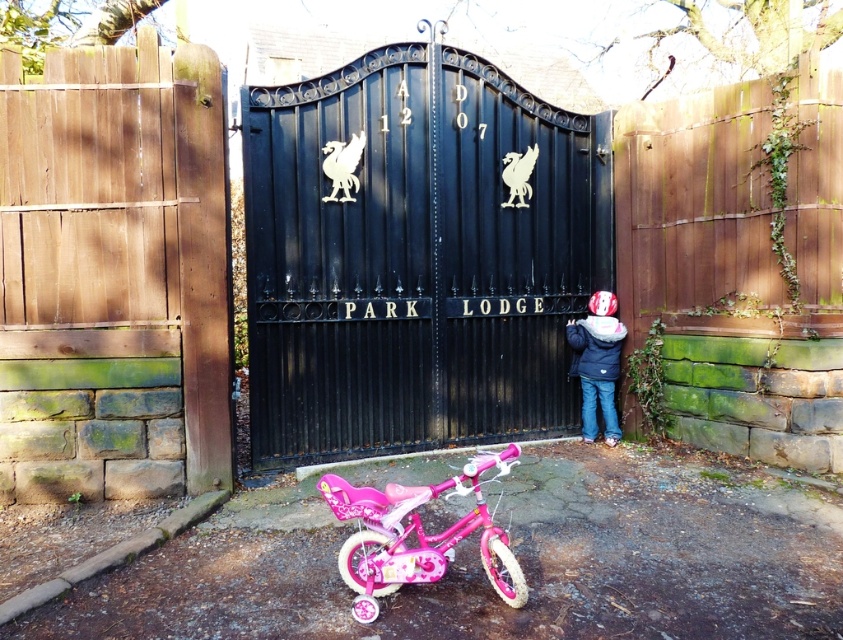
Is point (283, 211) positioned in front of point (509, 584)?

No, it is not.

Between black metal gate at center and pink glossy bicycle at lower center, which one is positioned higher?

black metal gate at center

What do you see at coordinates (416, 257) in the screenshot? I see `black metal gate at center` at bounding box center [416, 257].

The height and width of the screenshot is (640, 843). I want to click on black metal gate at center, so click(416, 257).

Can you confirm if pink glossy bicycle at lower center is taller than matte blue jacket at center?

Incorrect, pink glossy bicycle at lower center's height is not larger of matte blue jacket at center's.

Is pink glossy bicycle at lower center closer to camera compared to matte blue jacket at center?

Yes, it is in front of matte blue jacket at center.

Between point (505, 570) and point (591, 372), which one is positioned in front?

Point (505, 570) is more forward.

Where is `pink glossy bicycle at lower center`? Image resolution: width=843 pixels, height=640 pixels. pink glossy bicycle at lower center is located at coordinates (417, 536).

Is point (256, 204) positioned behind point (589, 404)?

No, (256, 204) is in front of (589, 404).

Is point (516, 198) in front of point (608, 332)?

Yes, point (516, 198) is in front of point (608, 332).

Locate an element on the screen. The image size is (843, 640). black metal gate at center is located at coordinates (416, 257).